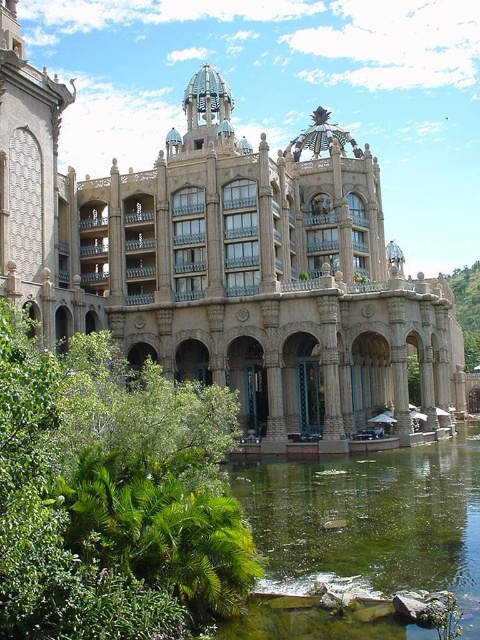
Question: Among these points, which one is farthest from the camera?

Choices:
 (A) (163, 536)
 (B) (402, 572)

Answer: (B)

Question: Can you confirm if green leafy bush at lower left is positioned to the right of green mossy pond at lower center?

Choices:
 (A) no
 (B) yes

Answer: (A)

Question: Among these points, which one is farthest from the camera?

Choices:
 (A) pyautogui.click(x=8, y=284)
 (B) pyautogui.click(x=200, y=490)

Answer: (A)

Question: Observing the image, what is the correct spatial positioning of beige stone palace at center in reference to green mossy pond at lower center?

Choices:
 (A) left
 (B) right

Answer: (A)

Question: Which of these objects is positioned closest to the green mossy pond at lower center?

Choices:
 (A) green leafy bush at lower left
 (B) beige stone palace at center

Answer: (A)

Question: Does green leafy bush at lower left have a smaller size compared to green mossy pond at lower center?

Choices:
 (A) no
 (B) yes

Answer: (A)